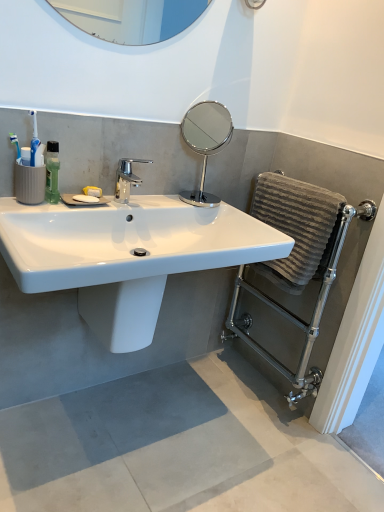
Identify the location of vacant space underneath white glossy bidet at center (from a real-world perspective). The image size is (384, 512). (114, 409).